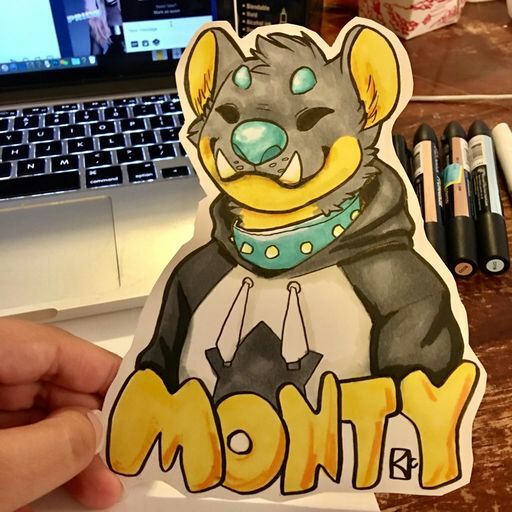
Locate an element on the screen. sticker is located at coordinates (312, 306).